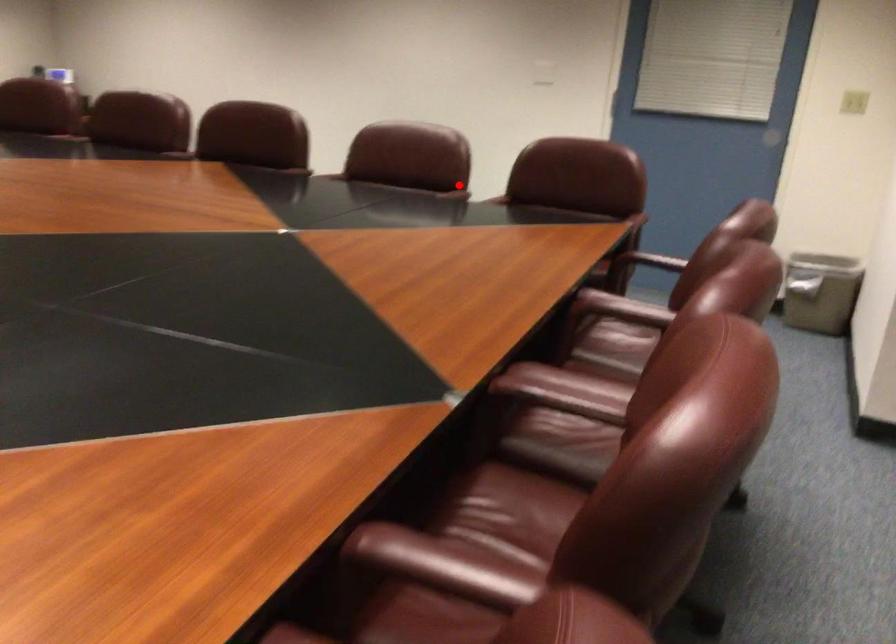
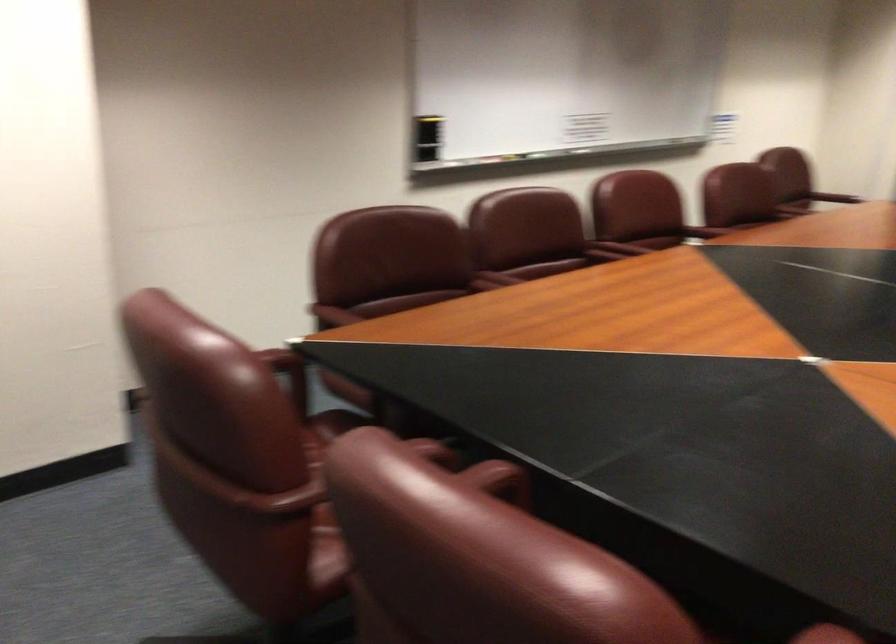
The point at the highlighted location is marked in the first image. Where is the corresponding point in the second image?

(495, 478)